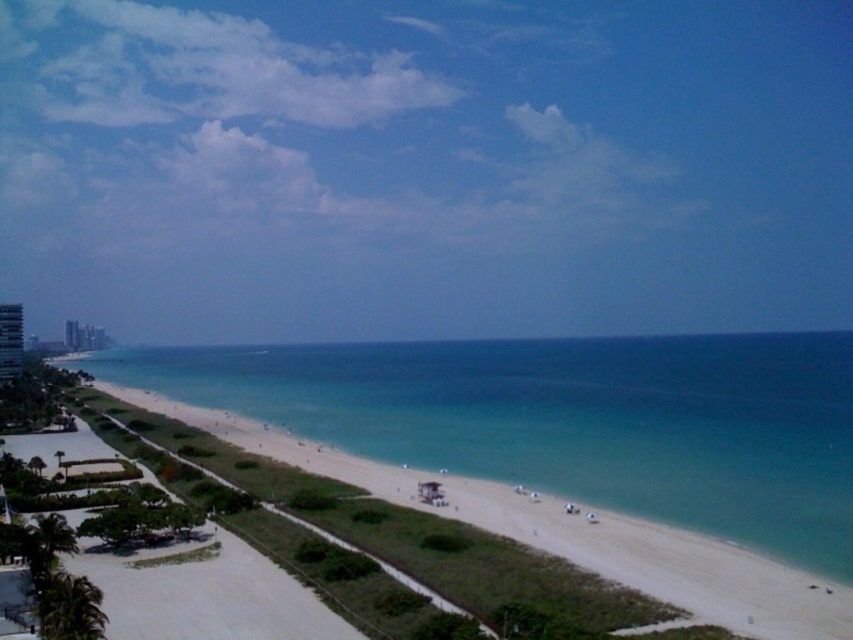
Question: Which of the following is the farthest from the observer?

Choices:
 (A) white concrete building at left
 (B) clear blue water at center

Answer: (A)

Question: Can you confirm if clear blue water at center is smaller than white concrete building at left?

Choices:
 (A) yes
 (B) no

Answer: (B)

Question: Which of the following is the farthest from the observer?

Choices:
 (A) (492, 420)
 (B) (16, 308)

Answer: (B)

Question: Is clear blue water at center bigger than white concrete building at left?

Choices:
 (A) no
 (B) yes

Answer: (B)

Question: Is clear blue water at center smaller than white concrete building at left?

Choices:
 (A) no
 (B) yes

Answer: (A)

Question: Which of the following is the farthest from the observer?

Choices:
 (A) (22, 330)
 (B) (717, 529)

Answer: (A)